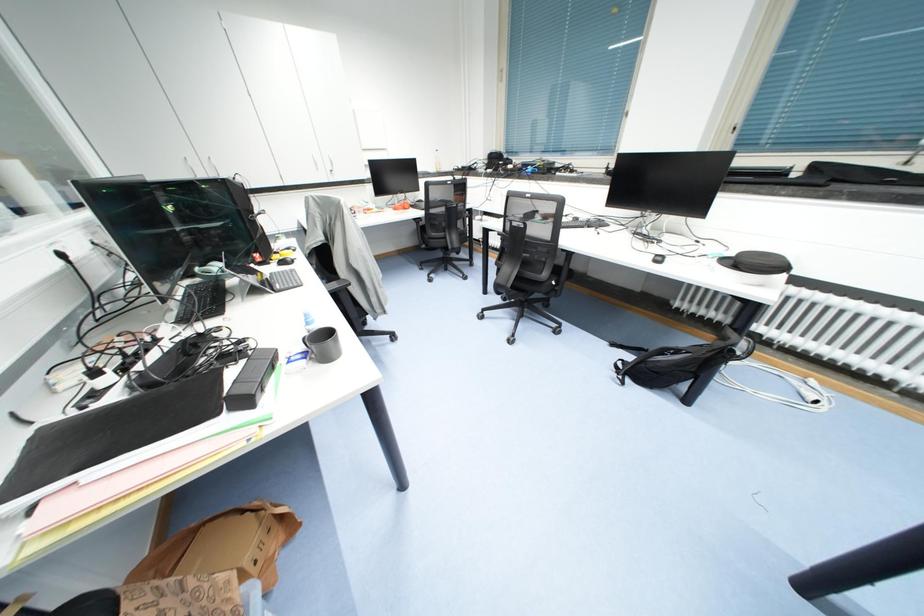
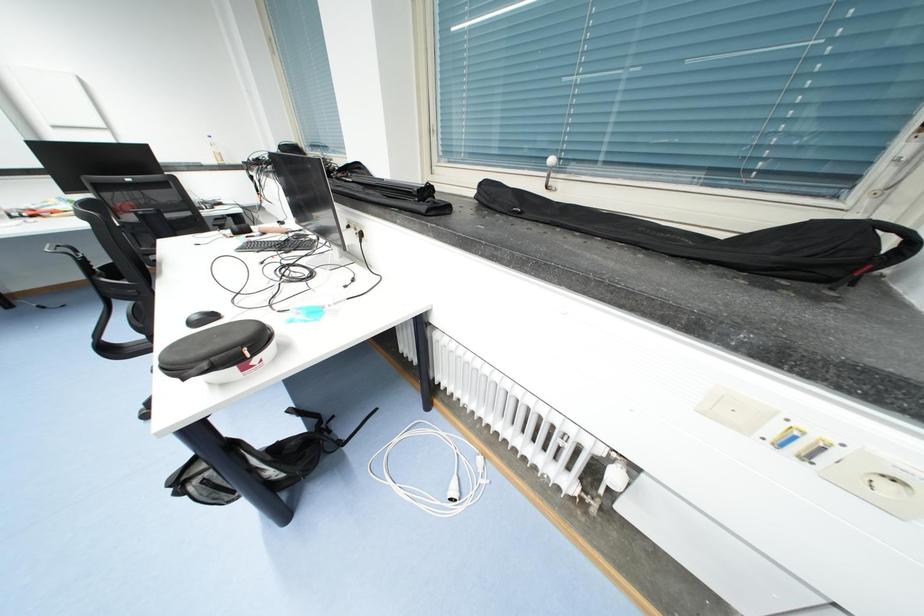
Question: The images are taken continuously from a first-person perspective. In which direction are you moving?

Choices:
 (A) Left
 (B) Right
 (C) Forward
 (D) Backward

Answer: (B)